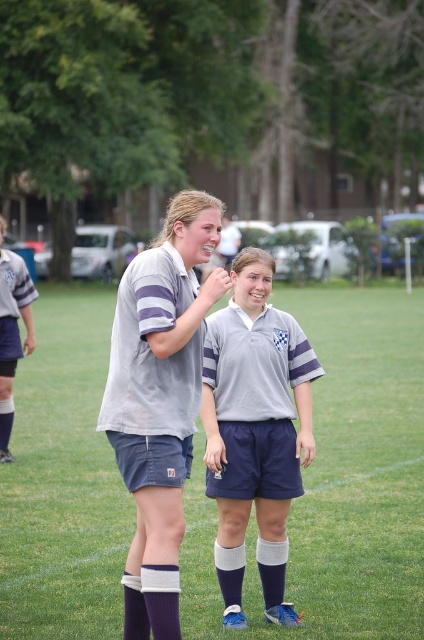
From the picture: You are a soccer coach observing the game. There are two players marked by points on the field. The first player is at point (122, 419) and the second is at point (226, 602). Which player is closer to the coach?

The player at point (122, 419) is closer to the coach because the point is in front of the other point.

Consider the image. You are a soccer coach observing the game from the sidelines. You notice two points marked on the field at coordinates point (243,536) and point (11,458). Which point is nearer to you?

Point (243,536) is closer to the viewer than point (11,458).